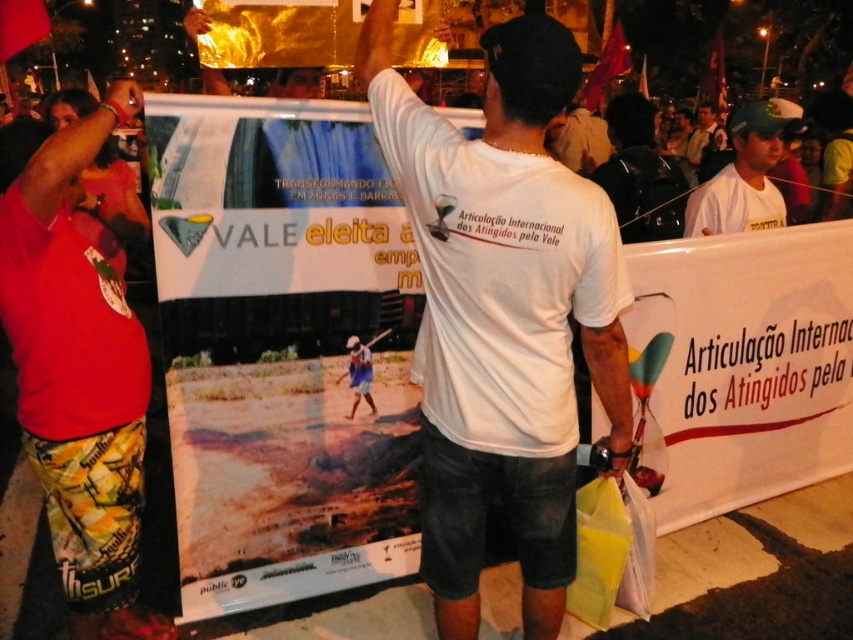
Is point (788, 403) more distant than point (618, 202)?

No, (788, 403) is closer to viewer.

Is matte white banner at center further to camera compared to black matte backpack at upper center?

No, it is not.

This screenshot has height=640, width=853. Describe the element at coordinates (281, 348) in the screenshot. I see `matte white banner at center` at that location.

Locate an element on the screen. This screenshot has width=853, height=640. matte white banner at center is located at coordinates (281, 348).

Between red cotton shirt at left and white t-shirt at center, which one appears on the right side from the viewer's perspective?

white t-shirt at center

Is red cotton shirt at left smaller than white t-shirt at center?

Yes, red cotton shirt at left is smaller than white t-shirt at center.

The height and width of the screenshot is (640, 853). I want to click on red cotton shirt at left, so click(79, 378).

Is black matte backpack at upper center positioned in front of green cap at upper right?

No.

Which of these two, black matte backpack at upper center or green cap at upper right, stands shorter?

green cap at upper right is shorter.

Identify the location of black matte backpack at upper center. (640, 173).